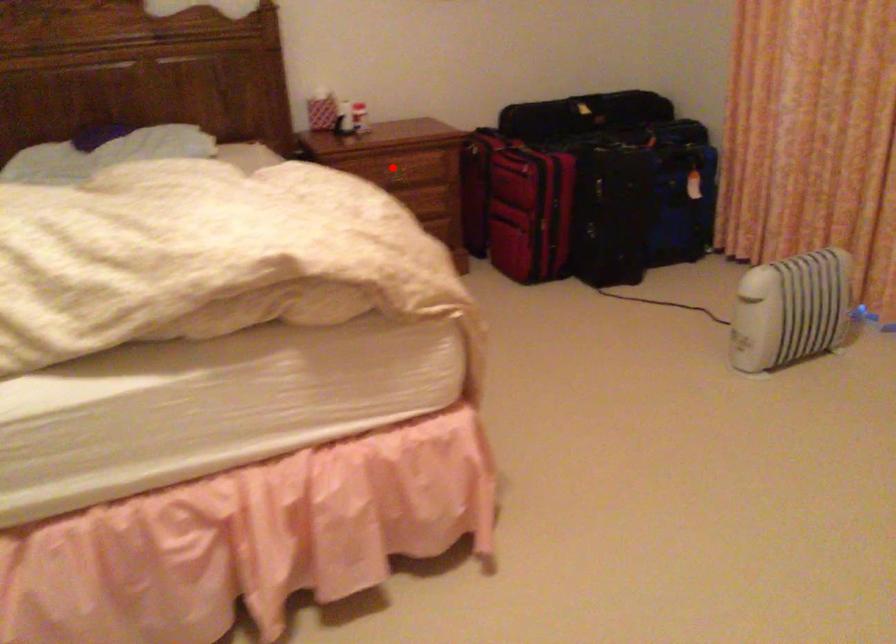
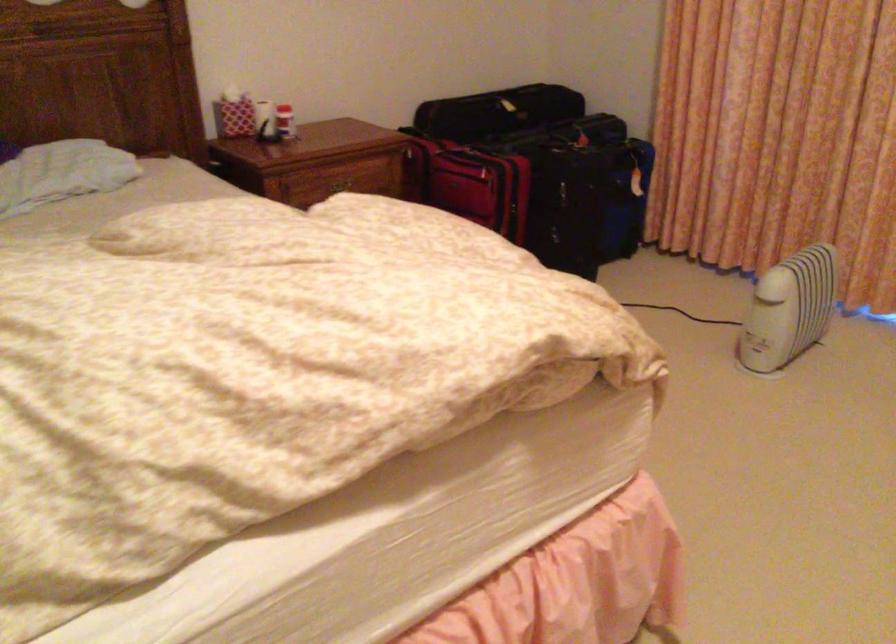
Question: I am providing you with two images of the same scene from different viewpoints. Image1 has a red point marked. In image2, the corresponding 3D location appears at what relative position? Reply with the corresponding letter.

Choices:
 (A) Closer
 (B) Farther

Answer: (A)